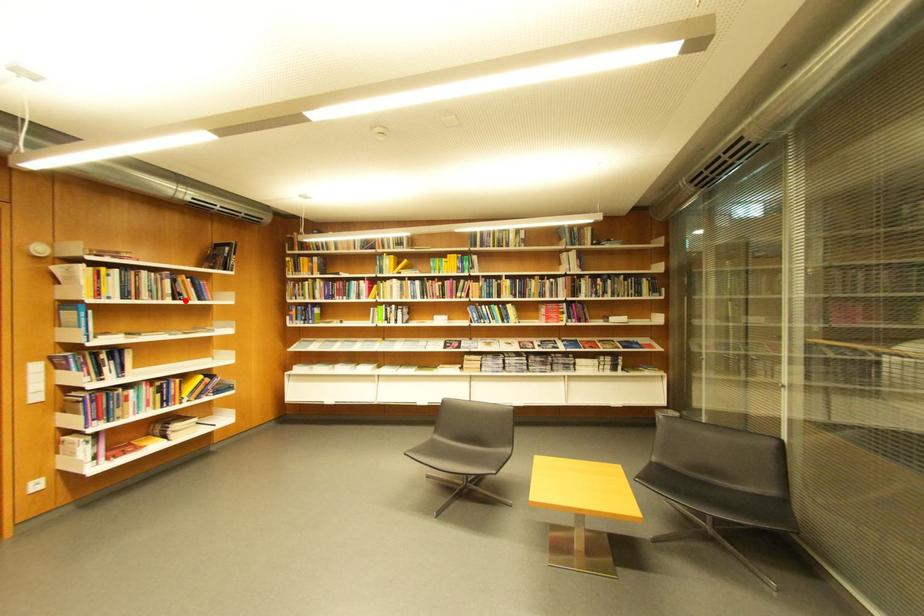
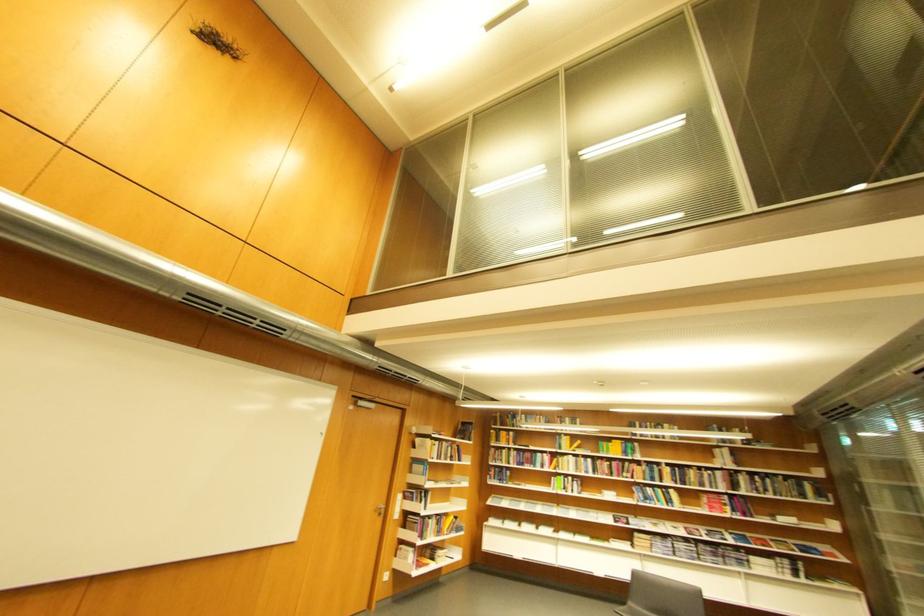
The point at the highlighted location is marked in the first image. Where is the corresponding point in the second image?

(460, 461)